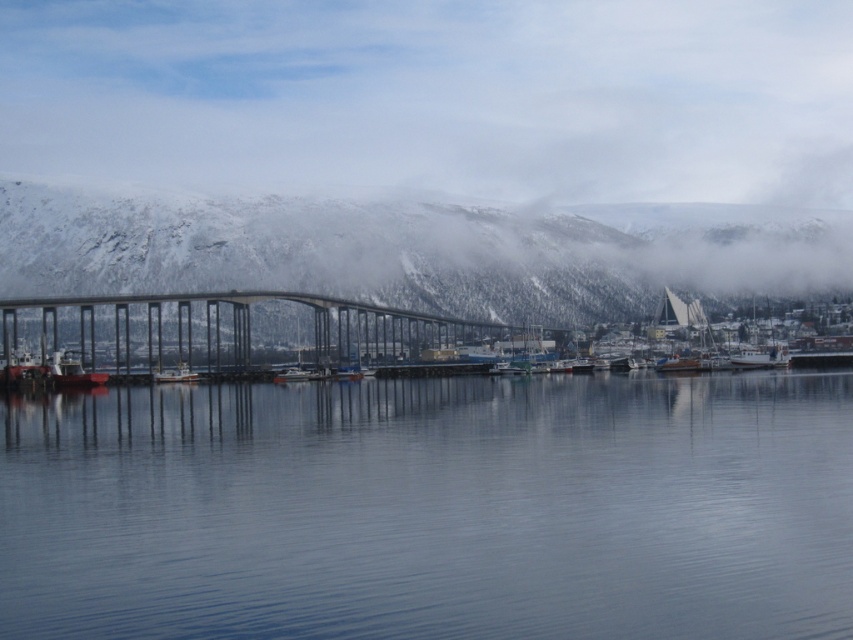
Question: Is smooth blue water at center below metallic silver boat at center?

Choices:
 (A) yes
 (B) no

Answer: (A)

Question: Estimate the real-world distances between objects in this image. Which object is closer to the concrete bridge at center?

Choices:
 (A) smooth blue water at center
 (B) snowy rock mountain at upper center

Answer: (B)

Question: Which of the following is the farthest from the observer?

Choices:
 (A) concrete bridge at center
 (B) metallic silver boat at center
 (C) snowy rock mountain at upper center

Answer: (C)

Question: Is smooth blue water at center in front of concrete bridge at center?

Choices:
 (A) no
 (B) yes

Answer: (B)

Question: Which object is the farthest from the concrete bridge at center?

Choices:
 (A) metallic silver boat at center
 (B) snowy rock mountain at upper center

Answer: (B)

Question: In this image, where is smooth blue water at center located relative to metallic silver boat at center?

Choices:
 (A) above
 (B) below

Answer: (B)